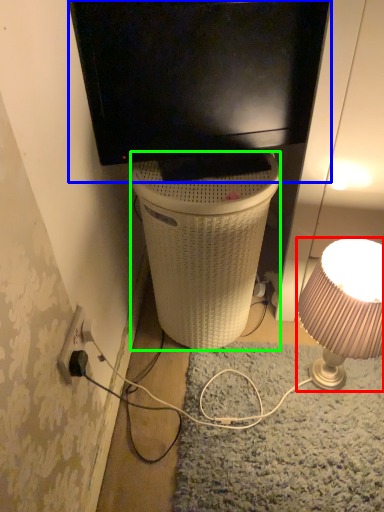
Question: Which object is the farthest from lamp (highlighted by a red box)? Choose among these: television (highlighted by a blue box) or trash bin/can (highlighted by a green box).

Choices:
 (A) television
 (B) trash bin/can

Answer: (A)